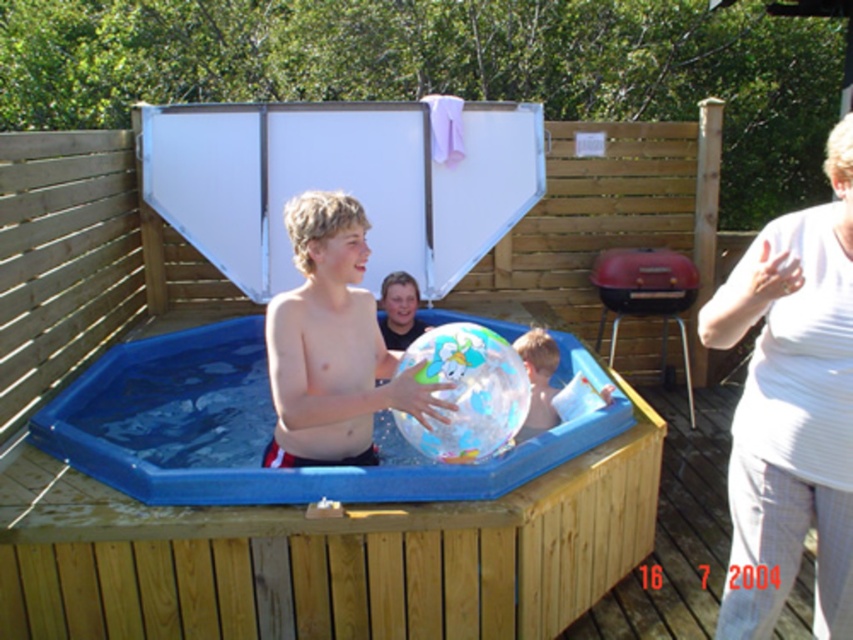
Does point (837, 321) come behind point (447, 387)?

No, it is not.

Is white textured shirt at right smaller than smooth skin boy at center?

No, white textured shirt at right is not smaller than smooth skin boy at center.

This screenshot has width=853, height=640. Find the location of `white textured shirt at right`. white textured shirt at right is located at coordinates (792, 406).

The image size is (853, 640). Find the location of `white textured shirt at right`. white textured shirt at right is located at coordinates (792, 406).

Is point (115, 387) positioned after point (404, 416)?

Yes, point (115, 387) is behind point (404, 416).

In the scene shown: Can you confirm if transparent plastic pool at center is taller than transparent plastic beach ball at center?

Correct, transparent plastic pool at center is much taller as transparent plastic beach ball at center.

Is point (99, 408) positioned behind point (486, 416)?

Yes, point (99, 408) is farther from viewer.

Find the location of `transparent plastic pool at center`. transparent plastic pool at center is located at coordinates (254, 432).

Is white textured shirt at right shorter than transparent plastic beach ball at center?

No.

Does point (820, 396) come farther from viewer compared to point (483, 448)?

No, it is not.

Find the location of a particular element. white textured shirt at right is located at coordinates (792, 406).